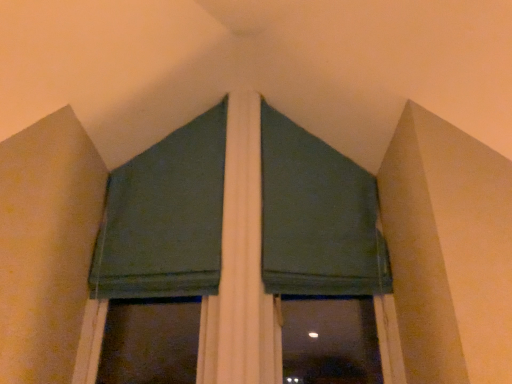
Question: Which direction should I rotate to look at dark green fabric at upper center, placed as the first curtain when sorted from right to left?

Choices:
 (A) right
 (B) left

Answer: (A)

Question: Is dark green fabric at center facing away from dark green fabric at upper center, the 2th curtain in the left-to-right sequence?

Choices:
 (A) no
 (B) yes

Answer: (B)

Question: Is dark green fabric at center oriented towards dark green fabric at upper center, placed as the first curtain when sorted from right to left?

Choices:
 (A) no
 (B) yes

Answer: (B)

Question: Does dark green fabric at center have a greater height compared to dark green fabric at upper center, placed as the first curtain when sorted from right to left?

Choices:
 (A) yes
 (B) no

Answer: (A)

Question: Can you confirm if dark green fabric at center is bigger than dark green fabric at upper center, the 2th curtain in the left-to-right sequence?

Choices:
 (A) no
 (B) yes

Answer: (B)

Question: Can you confirm if dark green fabric at center is positioned to the right of dark green fabric at upper center, the 2th curtain in the left-to-right sequence?

Choices:
 (A) yes
 (B) no

Answer: (B)

Question: Could dark green fabric at upper center, placed as the first curtain when sorted from right to left, be considered to be inside dark green fabric at center?

Choices:
 (A) yes
 (B) no

Answer: (A)

Question: Can you confirm if dark green fabric at upper center, placed as the first curtain when sorted from right to left, is taller than dark green fabric at center?

Choices:
 (A) no
 (B) yes

Answer: (A)

Question: From the image's perspective, does dark green fabric at upper center, placed as the first curtain when sorted from right to left, appear higher than dark green fabric at center?

Choices:
 (A) no
 (B) yes

Answer: (B)

Question: From a real-world perspective, is dark green fabric at upper center, the 2th curtain in the left-to-right sequence, on dark green fabric at center?

Choices:
 (A) yes
 (B) no

Answer: (A)

Question: Does dark green fabric at upper center, placed as the first curtain when sorted from right to left, have a lesser width compared to dark green fabric at center?

Choices:
 (A) no
 (B) yes

Answer: (B)

Question: Are dark green fabric at upper center, the 2th curtain in the left-to-right sequence, and dark green fabric at center beside each other?

Choices:
 (A) no
 (B) yes

Answer: (A)

Question: Does dark green fabric at upper center, placed as the first curtain when sorted from right to left, have a greater width compared to dark green fabric at center?

Choices:
 (A) no
 (B) yes

Answer: (A)

Question: Is dark green fabric at upper center, the second curtain from the right, positioned beyond the bounds of dark green fabric at upper center, placed as the first curtain when sorted from right to left?

Choices:
 (A) yes
 (B) no

Answer: (A)